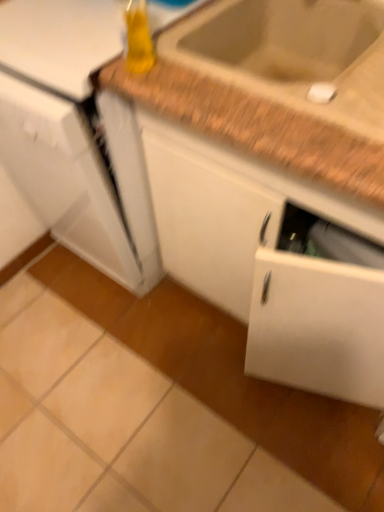
Identify the location of free space that is in between white glossy refrigerator at left and white matte cabinet at center. This screenshot has width=384, height=512. (191, 358).